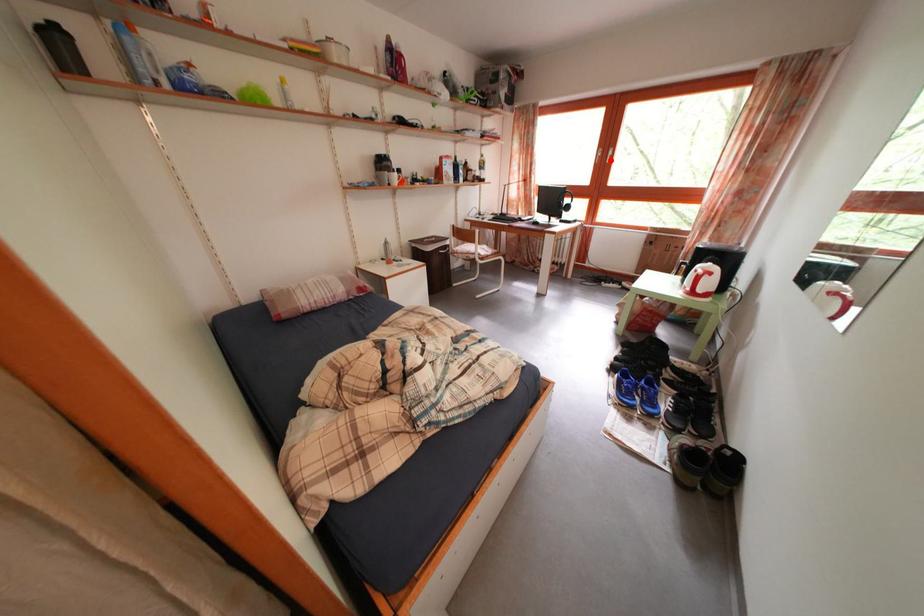
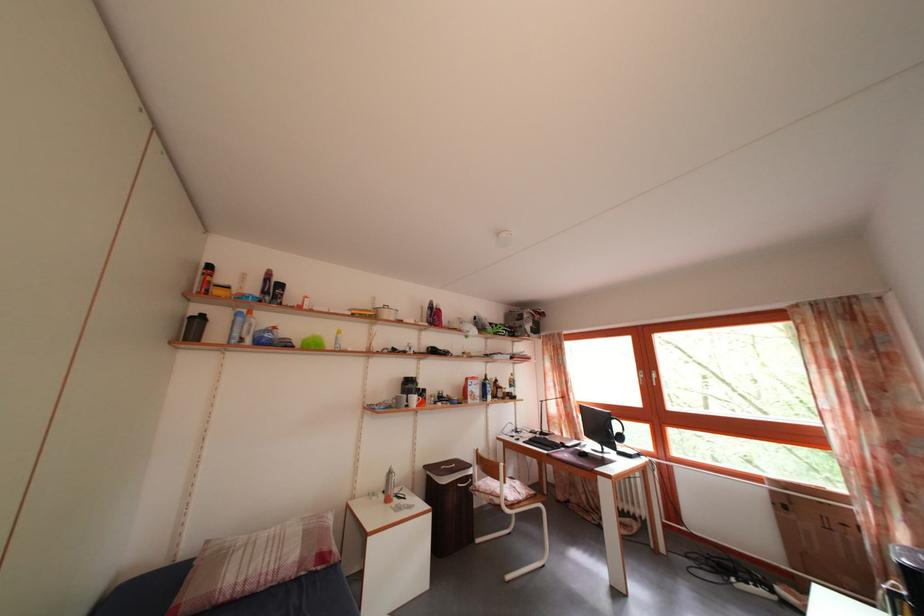
Locate, in the second image, the point that corresponds to the highlighted location in the first image.

(652, 382)